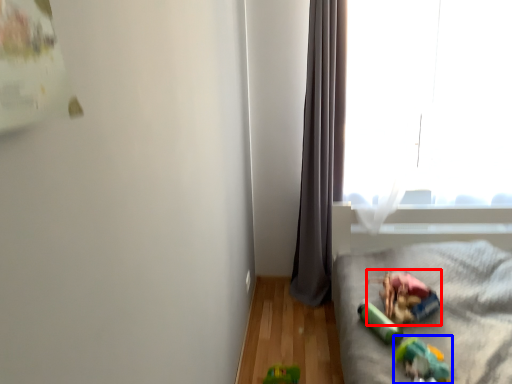
Question: Which object is closer to the camera taking this photo, stuff (highlighted by a red box) or toy (highlighted by a blue box)?

Choices:
 (A) stuff
 (B) toy

Answer: (B)